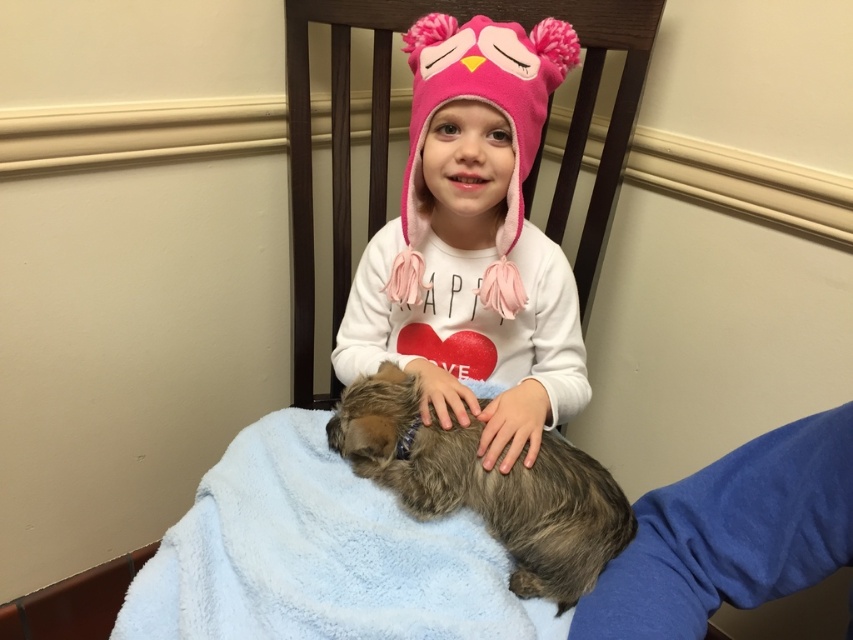
Question: Does pink fuzzy hat at center have a larger size compared to fluffy brown dog at center?

Choices:
 (A) no
 (B) yes

Answer: (B)

Question: Estimate the real-world distances between objects in this image. Which object is farther from the fluffy brown dog at center?

Choices:
 (A) pink fuzzy hat at center
 (B) blue soft blanket at lower center

Answer: (A)

Question: Which point is closer to the camera?

Choices:
 (A) fluffy brown dog at center
 (B) pink fuzzy hat at center
 (C) blue soft blanket at lower center

Answer: (C)

Question: Which of the following is the farthest from the observer?

Choices:
 (A) pink fuzzy hat at center
 (B) fluffy brown dog at center
 (C) blue soft blanket at lower center

Answer: (A)

Question: Does blue soft blanket at lower center have a smaller size compared to fluffy brown dog at center?

Choices:
 (A) yes
 (B) no

Answer: (B)

Question: Is blue soft blanket at lower center wider than fluffy brown dog at center?

Choices:
 (A) yes
 (B) no

Answer: (A)